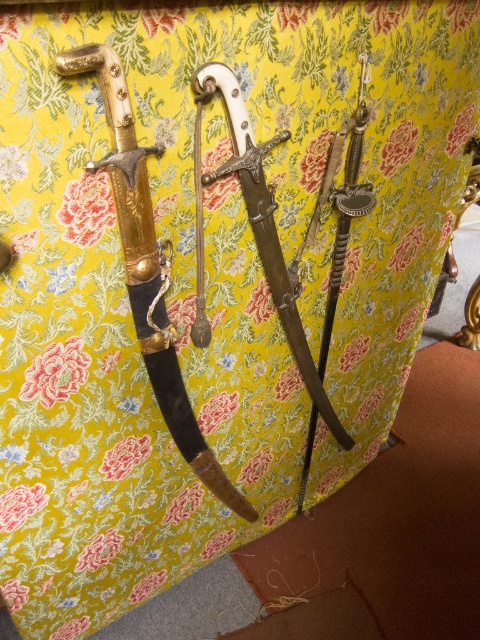
You are a collector who wants to place a new 6 inch wide decorative plate between the polished silver dagger at center and the polished silver sword at center. Can you fit it there?

The polished silver dagger at center and the polished silver sword at center are 5.84 inches apart. Since the plate is 6 inches wide, it cannot fit between them as the space is slightly smaller than the plate.

You are a collector who wants to place a new decorative item on the table between the gold plated dagger at left and the silver sword in the middle. Where should you place it to ensure it is centered between them?

To center the new item between the gold plated dagger at left and the silver sword in the middle, you should place it at the midpoint between their positions. Since the gold plated dagger at left is at point (147, 268), the midpoint would be halfway between these coordinates and the position of the silver sword in the middle. However, without the exact coordinates of the silver sword in the middle, an accurate placement cannot be determined.

You are a photographer holding a camera and want to take a closeup shot of the gold plated dagger at left. The camera has a minimum focusing distance of 28 inches. Can you take the photo without moving either the camera or the dagger?

The gold plated dagger at left and camera are 29.18 inches apart from each other. Since the minimum focusing distance is 28 inches, you can take the photo without moving either the camera or the dagger because the distance is within the camera